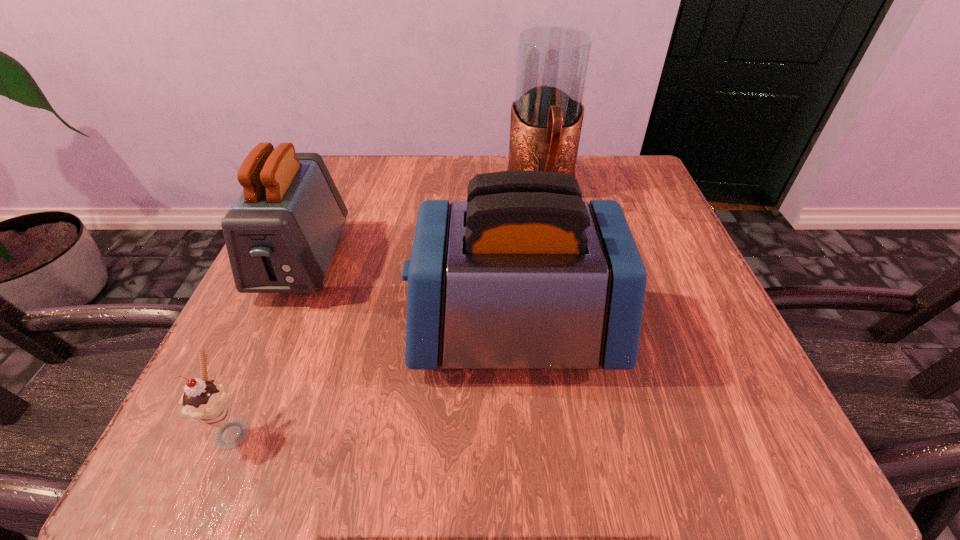
Locate an element on the screen. Image resolution: width=960 pixels, height=540 pixels. free region located 0.150m on the front-facing side of the right toaster is located at coordinates (317, 332).

In order to click on free space located 0.150m on the front-facing side of the shorter toaster in this screenshot , I will do `click(248, 387)`.

Identify the location of blank area located on the right of the nearest object. The height and width of the screenshot is (540, 960). (541, 428).

Locate an element on the screen. object at the far edge is located at coordinates (546, 120).

Image resolution: width=960 pixels, height=540 pixels. What are the coordinates of `object that is at the near edge` in the screenshot? It's located at (205, 401).

Where is `toaster located in the left edge section of the desktop`? The image size is (960, 540). toaster located in the left edge section of the desktop is located at coordinates (281, 232).

This screenshot has width=960, height=540. Find the location of `icecream present at the left edge`. icecream present at the left edge is located at coordinates (205, 401).

The height and width of the screenshot is (540, 960). I want to click on object that is at the near left corner, so point(205,401).

In the image, there is a desktop. Identify the location of vacant area at the far edge. (489, 161).

Identify the location of vacant region at the near edge of the desktop. (343, 413).